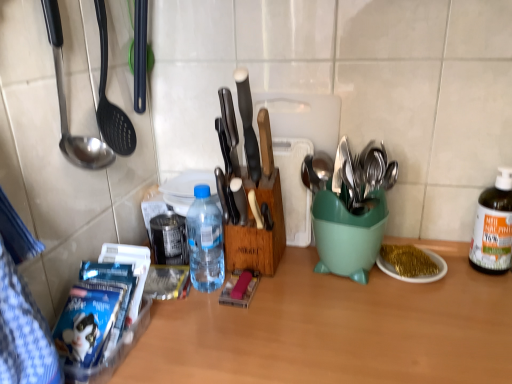
Identify the location of vacant space in front of white plastic cutting board at center. (302, 289).